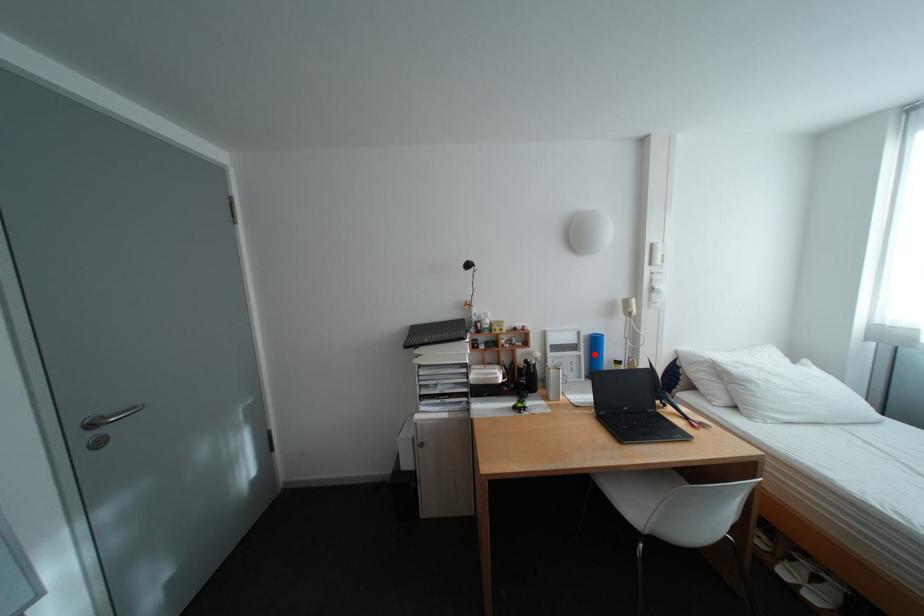
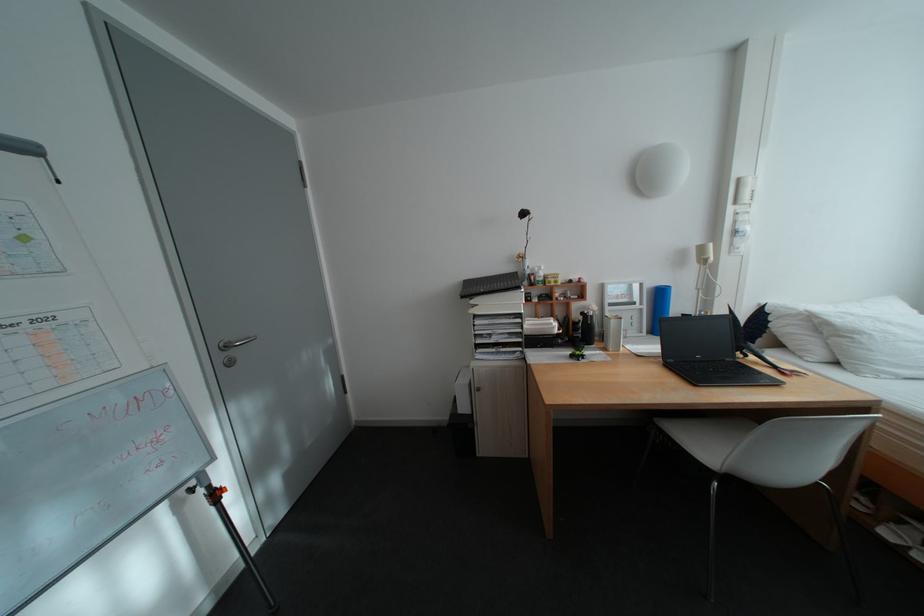
Locate, in the second image, the point that corresponds to the highlighted location in the first image.

(657, 307)